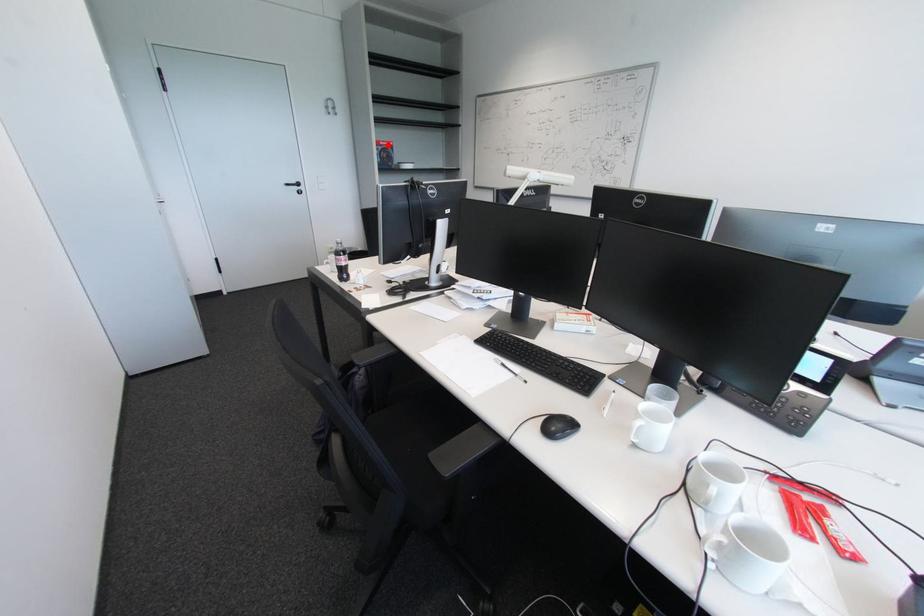
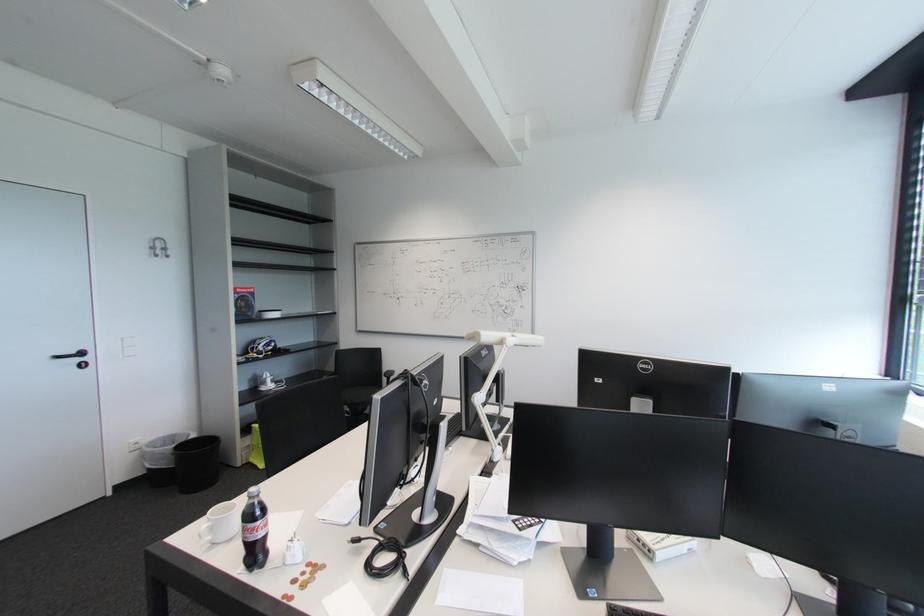
Question: I am providing you with two images of the same scene from different viewpoints. Given a red point in image1, look at the same physical point in image2. Is it:

Choices:
 (A) Closer to the viewpoint
 (B) Farther from the viewpoint

Answer: (B)